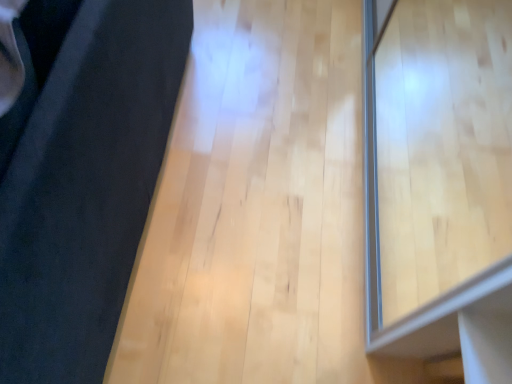
Question: Is transparent glass window at right in front of or behind black fabric at left in the image?

Choices:
 (A) front
 (B) behind

Answer: (B)

Question: Is transparent glass window at right taller or shorter than black fabric at left?

Choices:
 (A) short
 (B) tall

Answer: (A)

Question: In terms of width, does transparent glass window at right look wider or thinner when compared to black fabric at left?

Choices:
 (A) thin
 (B) wide

Answer: (A)

Question: Is black fabric at left in front of or behind transparent glass window at right in the image?

Choices:
 (A) front
 (B) behind

Answer: (A)

Question: In terms of size, does black fabric at left appear bigger or smaller than transparent glass window at right?

Choices:
 (A) small
 (B) big

Answer: (B)

Question: Looking at their shapes, would you say black fabric at left is wider or thinner than transparent glass window at right?

Choices:
 (A) wide
 (B) thin

Answer: (A)

Question: Would you say black fabric at left is inside or outside transparent glass window at right?

Choices:
 (A) outside
 (B) inside

Answer: (A)